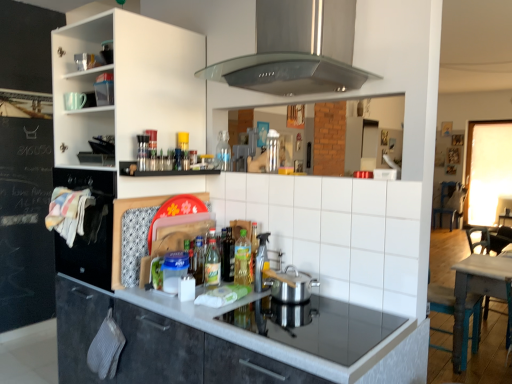
Image resolution: width=512 pixels, height=384 pixels. What are the coordinates of `vacant space to the left of translucent plastic spray bottle at center, which appears as the first appliance when ordered from the bottom` in the screenshot? It's located at (228, 288).